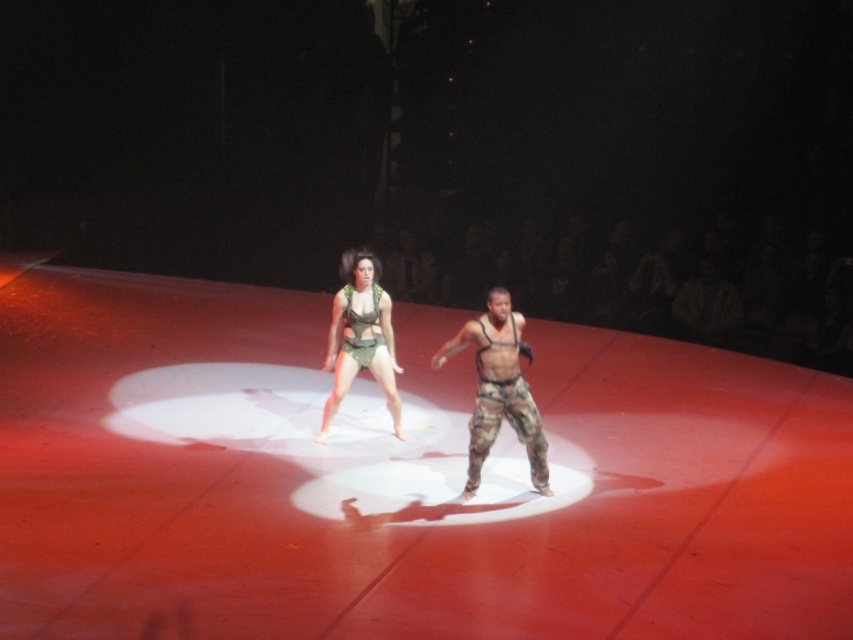
Question: From the image, what is the correct spatial relationship of camouflage pants at center in relation to green fabric harness at center?

Choices:
 (A) left
 (B) right

Answer: (B)

Question: Which of the following is the farthest from the observer?

Choices:
 (A) (496, 392)
 (B) (386, 380)

Answer: (B)

Question: Is camouflage pants at center below green fabric harness at center?

Choices:
 (A) no
 (B) yes

Answer: (B)

Question: Observing the image, what is the correct spatial positioning of camouflage pants at center in reference to green fabric harness at center?

Choices:
 (A) right
 (B) left

Answer: (A)